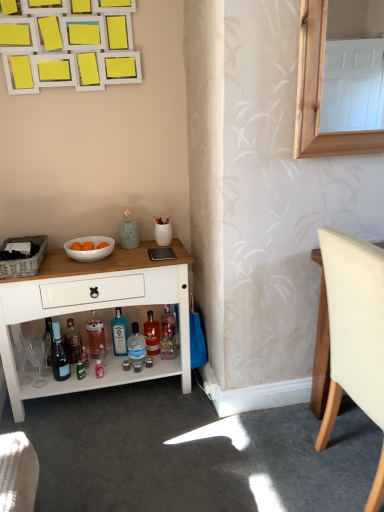
Locate an element on the screen. free space in front of white glossy bowl at center is located at coordinates (80, 271).